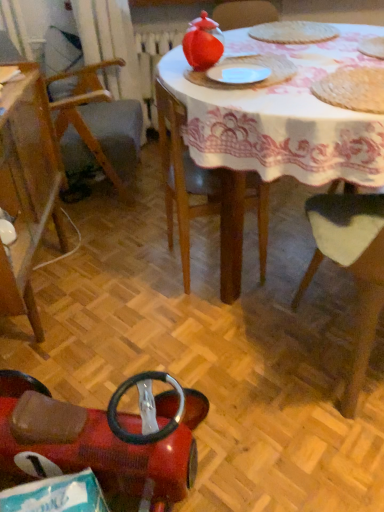
Where is `free spot behind white matte paper plate at center`? The height and width of the screenshot is (512, 384). free spot behind white matte paper plate at center is located at coordinates (248, 61).